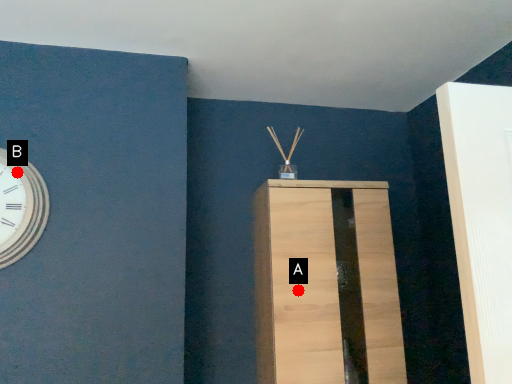
Question: Two points are circled on the image, labeled by A and B beside each circle. Which of the following is the closest to the observer?

Choices:
 (A) A is closer
 (B) B is closer

Answer: (B)